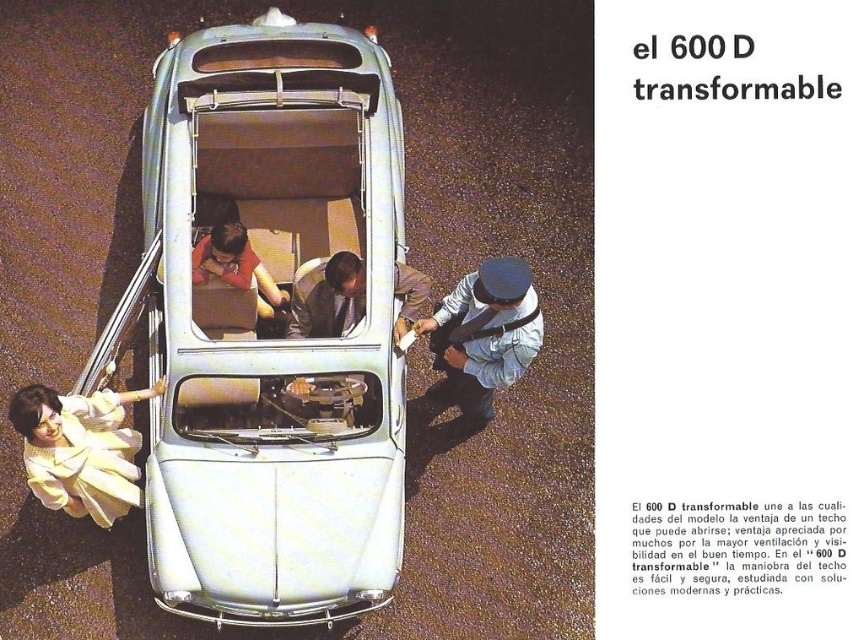
Question: Which object appears closest to the camera in this image?

Choices:
 (A) silver metallic car at center
 (B) light blue denim jacket at center
 (C) light brown leather jacket at center

Answer: (A)

Question: Is silver metallic car at center to the right of light brown leather jacket at center from the viewer's perspective?

Choices:
 (A) yes
 (B) no

Answer: (B)

Question: Based on their relative distances, which object is farther from the light yellow fabric at lower left?

Choices:
 (A) light brown leather jacket at center
 (B) silver metallic car at center

Answer: (A)

Question: Which point appears closest to the camera in this image?

Choices:
 (A) (467, 294)
 (B) (392, 237)

Answer: (B)

Question: Can you confirm if silver metallic car at center is positioned to the left of light yellow fabric at lower left?

Choices:
 (A) no
 (B) yes

Answer: (A)

Question: Is light blue denim jacket at center to the left of light brown leather jacket at center from the viewer's perspective?

Choices:
 (A) no
 (B) yes

Answer: (A)